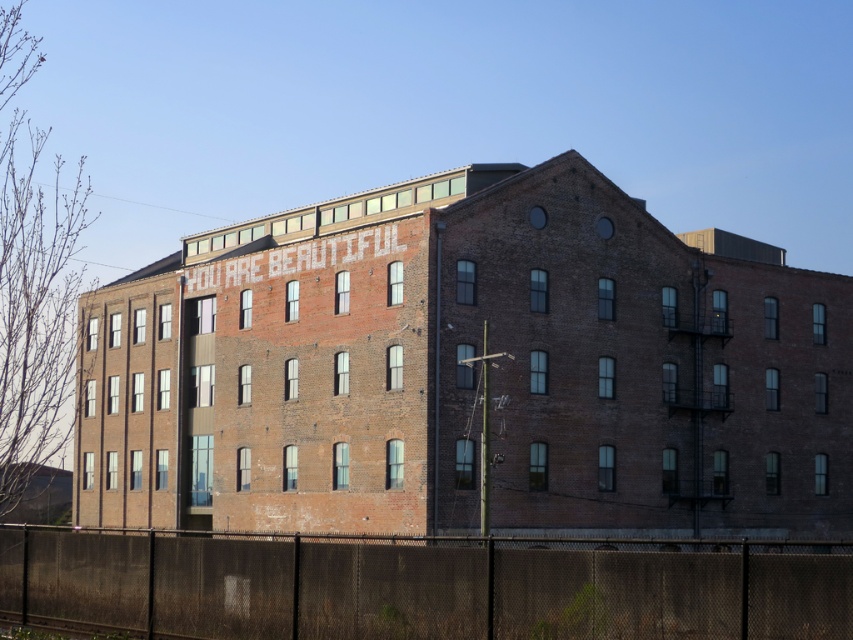
You are standing in front of the brown brick building at center and want to walk around to the other side. Is the black mesh fence at lower center in your way?

The brown brick building at center might be wider than the black mesh fence at lower center, so there is a possibility that the fence is not blocking the path around the building. However, without exact measurements, it is uncertain whether the fence is in the way or not.